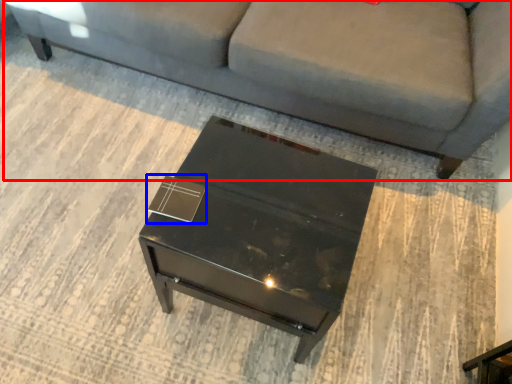
Question: Which point is closer to the camera, studio couch (highlighted by a red box) or square (highlighted by a blue box)?

Choices:
 (A) studio couch
 (B) square

Answer: (B)